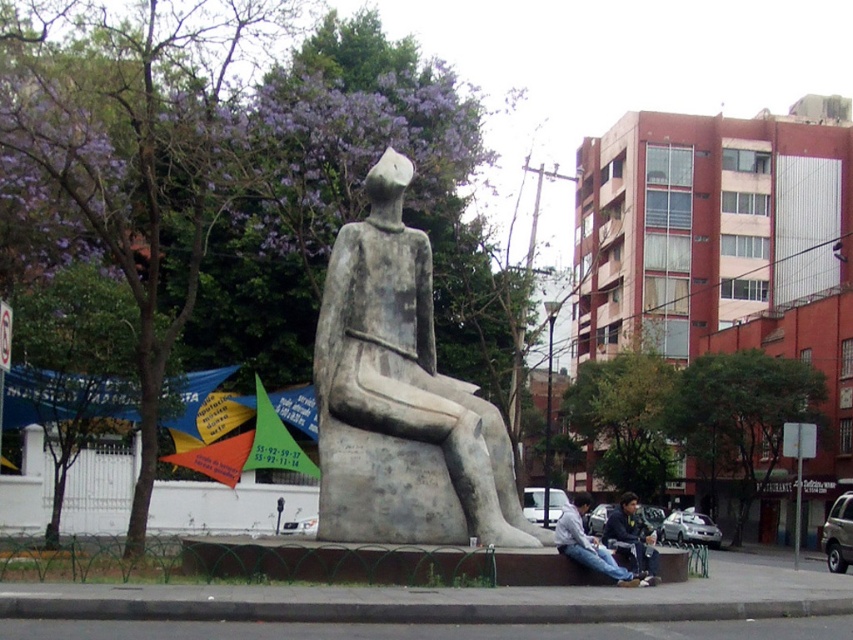
Who is higher up, gray stone statue at center or dark blue jeans at lower center?

gray stone statue at center is above.

I want to click on gray stone statue at center, so click(x=401, y=397).

Where is `gray stone statue at center`? This screenshot has width=853, height=640. gray stone statue at center is located at coordinates (401, 397).

Can you confirm if gray stone statue at center is smaller than denim jeans at lower center?

No, gray stone statue at center is not smaller than denim jeans at lower center.

Who is taller, gray stone statue at center or denim jeans at lower center?

Standing taller between the two is gray stone statue at center.

Is point (392, 518) positioned before point (630, 580)?

No, (392, 518) is further to viewer.

You are a GUI agent. You are given a task and a screenshot of the screen. Output one action in this format:
    pyautogui.click(x=<x>, y=<y>)
    Task: Click on the gray stone statue at center
    This screenshot has height=640, width=853.
    Given the screenshot: What is the action you would take?
    pyautogui.click(x=401, y=397)

Can you confirm if denim jeans at lower center is positioned below dark blue jeans at lower center?

No.

Is point (621, 584) farther from viewer compared to point (606, 529)?

No.

I want to click on denim jeans at lower center, so click(x=590, y=545).